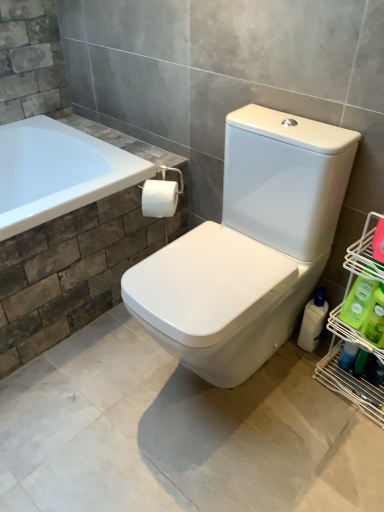
Image resolution: width=384 pixels, height=512 pixels. What are the coordinates of `green plastic bottle at lower right, which is counted as the third cleaning product, starting from the back` in the screenshot? It's located at (375, 319).

What do you see at coordinates (375, 319) in the screenshot?
I see `green plastic bottle at lower right, which is counted as the third cleaning product, starting from the back` at bounding box center [375, 319].

Describe the element at coordinates (159, 198) in the screenshot. I see `white matte toilet paper at center` at that location.

Where is `green plastic bottle at right, marked as the 2th cleaning product in a back-to-front arrangement`? The image size is (384, 512). green plastic bottle at right, marked as the 2th cleaning product in a back-to-front arrangement is located at coordinates (358, 302).

Where is `green plastic bottle at lower right, which is counted as the third cleaning product, starting from the back`? This screenshot has width=384, height=512. green plastic bottle at lower right, which is counted as the third cleaning product, starting from the back is located at coordinates (375, 319).

Who is smaller, green plastic bottle at right, marked as the 2th cleaning product in a back-to-front arrangement, or green plastic bottle at lower right, which is counted as the third cleaning product, starting from the back?

Smaller between the two is green plastic bottle at right, marked as the 2th cleaning product in a back-to-front arrangement.

From a real-world perspective, is green plastic bottle at right, which is the second cleaning product from front to back, on green plastic bottle at lower right, placed as the first cleaning product when sorted from front to back?

No, from a real-world perspective, green plastic bottle at right, which is the second cleaning product from front to back, is not over green plastic bottle at lower right, placed as the first cleaning product when sorted from front to back

From the image's perspective, does green plastic bottle at right, which is the second cleaning product from front to back, appear lower than green plastic bottle at lower right, placed as the first cleaning product when sorted from front to back?

Actually, green plastic bottle at right, which is the second cleaning product from front to back, appears above green plastic bottle at lower right, placed as the first cleaning product when sorted from front to back, in the image.

Between green plastic bottle at right, marked as the 2th cleaning product in a back-to-front arrangement, and green plastic bottle at lower right, which is counted as the third cleaning product, starting from the back, which one has less height?

Standing shorter between the two is green plastic bottle at right, marked as the 2th cleaning product in a back-to-front arrangement.

Is green plastic bottle at lower right, which is counted as the third cleaning product, starting from the back, wider or thinner than green plastic bottle at right, marked as the 2th cleaning product in a back-to-front arrangement?

In the image, green plastic bottle at lower right, which is counted as the third cleaning product, starting from the back, appears to be wider than green plastic bottle at right, marked as the 2th cleaning product in a back-to-front arrangement.

From the image's perspective, is green plastic bottle at lower right, placed as the first cleaning product when sorted from front to back, over green plastic bottle at right, marked as the 2th cleaning product in a back-to-front arrangement?

Actually, green plastic bottle at lower right, placed as the first cleaning product when sorted from front to back, appears below green plastic bottle at right, marked as the 2th cleaning product in a back-to-front arrangement, in the image.

Is green plastic bottle at lower right, placed as the first cleaning product when sorted from front to back, completely or partially outside of green plastic bottle at right, which is the second cleaning product from front to back?

green plastic bottle at lower right, placed as the first cleaning product when sorted from front to back, is positioned outside green plastic bottle at right, which is the second cleaning product from front to back.

At what (x,y) coordinates should I click in order to perform the action: click on the 1st cleaning product below the green plastic bottle at lower right, placed as the first cleaning product when sorted from front to back (from a real-world perspective). Please return your answer as a coordinate pair (x, y). Image resolution: width=384 pixels, height=512 pixels. Looking at the image, I should click on (358, 302).

Is white matte toilet paper at center bigger than green plastic bottle at right, marked as the 2th cleaning product in a back-to-front arrangement?

Yes.

From the image's perspective, who appears lower, white matte toilet paper at center or green plastic bottle at right, which is the second cleaning product from front to back?

green plastic bottle at right, which is the second cleaning product from front to back, is shown below in the image.

Is white matte toilet paper at center inside the boundaries of green plastic bottle at right, which is the second cleaning product from front to back, or outside?

white matte toilet paper at center is not inside green plastic bottle at right, which is the second cleaning product from front to back, it's outside.

From the image's perspective, which cleaning product is the 1st one below the white matte toilet paper at center? Please provide its 2D coordinates.

[(358, 302)]

Could you tell me if green plastic bottle at right, marked as the 2th cleaning product in a back-to-front arrangement, is turned towards white matte toilet paper at center?

No.

Which object is thinner, green plastic bottle at right, which is the second cleaning product from front to back, or white matte toilet paper at center?

Thinner between the two is green plastic bottle at right, which is the second cleaning product from front to back.

Which of these two, green plastic bottle at right, marked as the 2th cleaning product in a back-to-front arrangement, or white matte toilet paper at center, stands shorter?

With less height is white matte toilet paper at center.

Where is `the 1st cleaning product to the right of the white glossy bottle at lower right, which is counted as the third cleaning product, starting from the front, counting from the anchor's position`? Image resolution: width=384 pixels, height=512 pixels. the 1st cleaning product to the right of the white glossy bottle at lower right, which is counted as the third cleaning product, starting from the front, counting from the anchor's position is located at coordinates (358, 302).

From their relative heights in the image, would you say white glossy bottle at lower right, marked as the 1th cleaning product in a back-to-front arrangement, is taller or shorter than green plastic bottle at right, which is the second cleaning product from front to back?

white glossy bottle at lower right, marked as the 1th cleaning product in a back-to-front arrangement, is taller than green plastic bottle at right, which is the second cleaning product from front to back.

Which object is closer to the camera, white glossy bottle at lower right, marked as the 1th cleaning product in a back-to-front arrangement, or green plastic bottle at right, which is the second cleaning product from front to back?

green plastic bottle at right, which is the second cleaning product from front to back, is more forward.

What's the angular difference between white glossy bottle at lower right, which is counted as the third cleaning product, starting from the front, and green plastic bottle at right, marked as the 2th cleaning product in a back-to-front arrangement,'s facing directions?

The facing directions of white glossy bottle at lower right, which is counted as the third cleaning product, starting from the front, and green plastic bottle at right, marked as the 2th cleaning product in a back-to-front arrangement, are 5.43 degrees apart.

Would you say white matte toilet paper at center is a long distance from green plastic bottle at lower right, which is counted as the third cleaning product, starting from the back?

No, white matte toilet paper at center is in close proximity to green plastic bottle at lower right, which is counted as the third cleaning product, starting from the back.

Is green plastic bottle at lower right, placed as the first cleaning product when sorted from front to back, completely or partially inside white matte toilet paper at center?

That's incorrect, green plastic bottle at lower right, placed as the first cleaning product when sorted from front to back, is not inside white matte toilet paper at center.

Based on the photo, can you confirm if white matte toilet paper at center is positioned to the right of green plastic bottle at lower right, which is counted as the third cleaning product, starting from the back?

No.

Can you confirm if white matte toilet paper at center is bigger than green plastic bottle at lower right, placed as the first cleaning product when sorted from front to back?

Indeed, white matte toilet paper at center has a larger size compared to green plastic bottle at lower right, placed as the first cleaning product when sorted from front to back.

Is green plastic bottle at lower right, placed as the first cleaning product when sorted from front to back, spatially inside white glossy bottle at lower right, which is counted as the third cleaning product, starting from the front, or outside of it?

green plastic bottle at lower right, placed as the first cleaning product when sorted from front to back, is not enclosed by white glossy bottle at lower right, which is counted as the third cleaning product, starting from the front.

Does point (380, 340) lie behind point (306, 313)?

No, (380, 340) is closer to viewer.

How far apart are green plastic bottle at lower right, which is counted as the third cleaning product, starting from the back, and white glossy bottle at lower right, which is counted as the third cleaning product, starting from the front?

green plastic bottle at lower right, which is counted as the third cleaning product, starting from the back, is 9.14 inches from white glossy bottle at lower right, which is counted as the third cleaning product, starting from the front.

Is green plastic bottle at lower right, placed as the first cleaning product when sorted from front to back, wider or thinner than white glossy bottle at lower right, marked as the 1th cleaning product in a back-to-front arrangement?

green plastic bottle at lower right, placed as the first cleaning product when sorted from front to back, is thinner than white glossy bottle at lower right, marked as the 1th cleaning product in a back-to-front arrangement.

Find the location of a particular element. the 1st cleaning product below the green plastic bottle at right, which is the second cleaning product from front to back (from the image's perspective) is located at coordinates (375, 319).

From a real-world perspective, count 1st cleaning products downward from the green plastic bottle at lower right, which is counted as the third cleaning product, starting from the back, and point to it. Please provide its 2D coordinates.

[(358, 302)]

From the image, which object appears to be nearer to white glossy bottle at lower right, which is counted as the third cleaning product, starting from the front, green plastic bottle at lower right, which is counted as the third cleaning product, starting from the back, or green plastic bottle at right, marked as the 2th cleaning product in a back-to-front arrangement?

green plastic bottle at right, marked as the 2th cleaning product in a back-to-front arrangement, is positioned closer to the anchor white glossy bottle at lower right, which is counted as the third cleaning product, starting from the front.

Which object lies nearer to the anchor point green plastic bottle at lower right, which is counted as the third cleaning product, starting from the back, white glossy bottle at lower right, which is counted as the third cleaning product, starting from the front, or white matte toilet paper at center?

white glossy bottle at lower right, which is counted as the third cleaning product, starting from the front.

Estimate the real-world distances between objects in this image. Which object is further from white matte toilet paper at center, white glossy bottle at lower right, marked as the 1th cleaning product in a back-to-front arrangement, or green plastic bottle at right, which is the second cleaning product from front to back?

green plastic bottle at right, which is the second cleaning product from front to back, lies further to white matte toilet paper at center than the other object.

Looking at this image, which object lies further to the anchor point white glossy bottle at lower right, which is counted as the third cleaning product, starting from the front, green plastic bottle at right, which is the second cleaning product from front to back, or green plastic bottle at lower right, placed as the first cleaning product when sorted from front to back?

green plastic bottle at lower right, placed as the first cleaning product when sorted from front to back, is positioned further to the anchor white glossy bottle at lower right, which is counted as the third cleaning product, starting from the front.

From the image, which object appears to be farther from white glossy bottle at lower right, which is counted as the third cleaning product, starting from the front, white matte toilet paper at center or green plastic bottle at right, marked as the 2th cleaning product in a back-to-front arrangement?

A: The object further to white glossy bottle at lower right, which is counted as the third cleaning product, starting from the front, is white matte toilet paper at center.

From the image, which object appears to be nearer to white matte toilet paper at center, green plastic bottle at right, marked as the 2th cleaning product in a back-to-front arrangement, or green plastic bottle at lower right, placed as the first cleaning product when sorted from front to back?

Based on the image, green plastic bottle at right, marked as the 2th cleaning product in a back-to-front arrangement, appears to be nearer to white matte toilet paper at center.

Looking at the image, which one is located further to white matte toilet paper at center, green plastic bottle at lower right, placed as the first cleaning product when sorted from front to back, or green plastic bottle at right, marked as the 2th cleaning product in a back-to-front arrangement?

green plastic bottle at lower right, placed as the first cleaning product when sorted from front to back, is positioned further to the anchor white matte toilet paper at center.

Considering their positions, is green plastic bottle at lower right, which is counted as the third cleaning product, starting from the back, positioned closer to green plastic bottle at right, marked as the 2th cleaning product in a back-to-front arrangement, than white glossy bottle at lower right, marked as the 1th cleaning product in a back-to-front arrangement?

green plastic bottle at lower right, which is counted as the third cleaning product, starting from the back, lies closer to green plastic bottle at right, marked as the 2th cleaning product in a back-to-front arrangement, than the other object.

What are the coordinates of `cleaning product situated between white matte toilet paper at center and green plastic bottle at right, marked as the 2th cleaning product in a back-to-front arrangement, from left to right` in the screenshot? It's located at (313, 321).

The width and height of the screenshot is (384, 512). Find the location of `cleaning product positioned between green plastic bottle at lower right, which is counted as the third cleaning product, starting from the back, and white glossy bottle at lower right, which is counted as the third cleaning product, starting from the front, from near to far`. cleaning product positioned between green plastic bottle at lower right, which is counted as the third cleaning product, starting from the back, and white glossy bottle at lower right, which is counted as the third cleaning product, starting from the front, from near to far is located at coordinates [x=358, y=302].